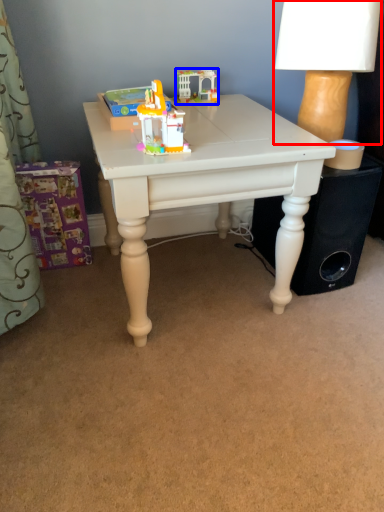
Question: Which of the following is the closest to the observer, table lamp (highlighted by a red box) or toy (highlighted by a blue box)?

Choices:
 (A) table lamp
 (B) toy

Answer: (A)